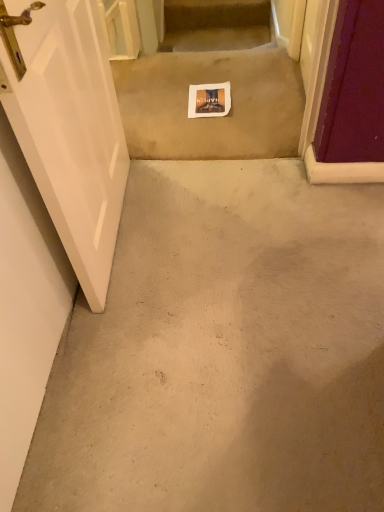
Question: Is beige carpet at center thinner than white glossy door at left?

Choices:
 (A) yes
 (B) no

Answer: (B)

Question: Would you consider beige carpet at center to be distant from white glossy door at left?

Choices:
 (A) no
 (B) yes

Answer: (A)

Question: Can you confirm if beige carpet at center is smaller than white glossy door at left?

Choices:
 (A) yes
 (B) no

Answer: (A)

Question: Is beige carpet at center to the right of white glossy door at left from the viewer's perspective?

Choices:
 (A) yes
 (B) no

Answer: (A)

Question: Is beige carpet at center not within white glossy door at left?

Choices:
 (A) no
 (B) yes

Answer: (B)

Question: Does beige carpet at center come in front of white glossy door at left?

Choices:
 (A) no
 (B) yes

Answer: (A)

Question: From a real-world perspective, is beige carpet at center positioned over white paper at center based on gravity?

Choices:
 (A) yes
 (B) no

Answer: (B)

Question: Is beige carpet at center not near white paper at center?

Choices:
 (A) yes
 (B) no

Answer: (B)

Question: From a real-world perspective, is beige carpet at center located beneath white paper at center?

Choices:
 (A) no
 (B) yes

Answer: (B)

Question: Is beige carpet at center looking in the opposite direction of white paper at center?

Choices:
 (A) no
 (B) yes

Answer: (B)

Question: Is beige carpet at center bigger than white paper at center?

Choices:
 (A) yes
 (B) no

Answer: (A)

Question: Can you confirm if beige carpet at center is positioned to the right of white paper at center?

Choices:
 (A) yes
 (B) no

Answer: (B)

Question: Does white paper at center have a smaller size compared to beige carpet at center?

Choices:
 (A) yes
 (B) no

Answer: (A)